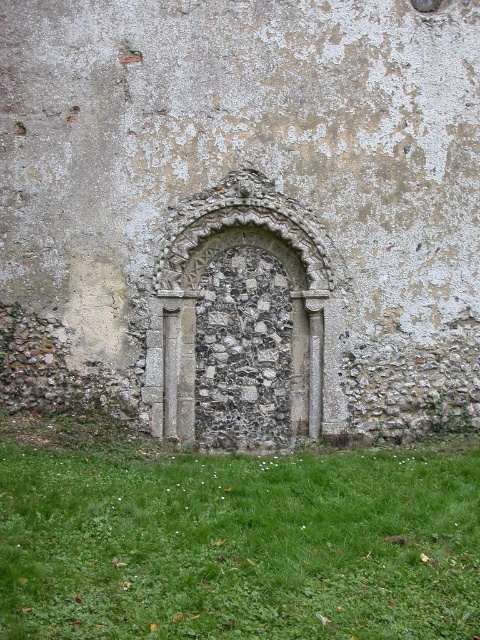
Question: From the image, what is the correct spatial relationship of green grass at lower center in relation to stone textured archway at center?

Choices:
 (A) right
 (B) left

Answer: (A)

Question: Which object is closer to the camera taking this photo?

Choices:
 (A) green grass at lower center
 (B) stone textured archway at center

Answer: (A)

Question: Does green grass at lower center appear on the right side of stone textured archway at center?

Choices:
 (A) yes
 (B) no

Answer: (A)

Question: Which point is farther to the camera?

Choices:
 (A) green grass at lower center
 (B) stone textured archway at center

Answer: (B)

Question: Can you confirm if green grass at lower center is positioned to the right of stone textured archway at center?

Choices:
 (A) yes
 (B) no

Answer: (A)